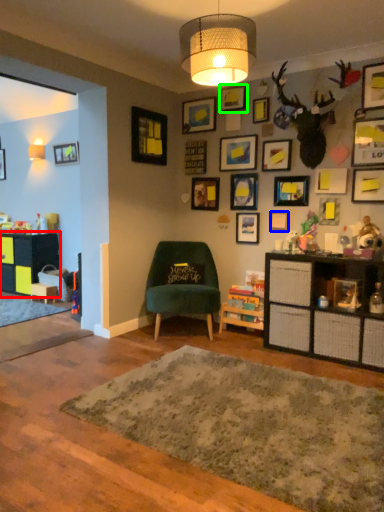
Question: Based on their relative distances, which object is farther from cabinetry (highlighted by a red box)? Choose from picture frame (highlighted by a blue box) and picture frame (highlighted by a green box).

Choices:
 (A) picture frame
 (B) picture frame

Answer: (A)